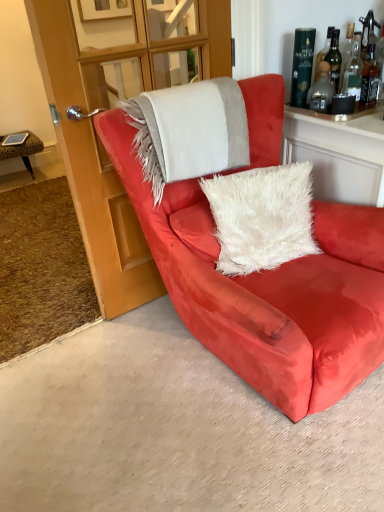
Where is `free space to the left of satin red armchair at center`? Image resolution: width=384 pixels, height=512 pixels. free space to the left of satin red armchair at center is located at coordinates coord(95,399).